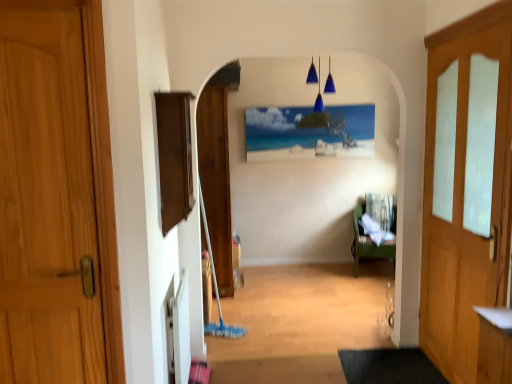
This screenshot has height=384, width=512. Identify the location of free region under blue glass pendant lights at upper center (from a real-world perspective). (320, 291).